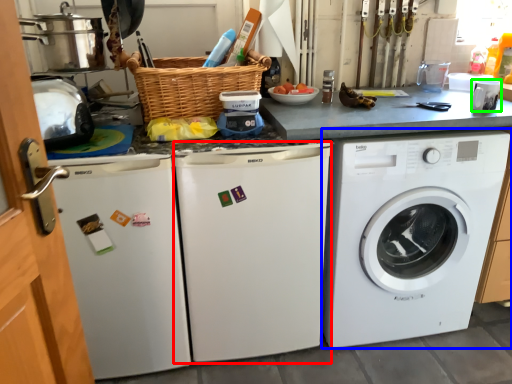
Question: Which object is positioned farthest from dish washer (highlighted by a red box)? Select from washing machine (highlighted by a blue box) and appliance (highlighted by a green box).

Choices:
 (A) washing machine
 (B) appliance

Answer: (B)